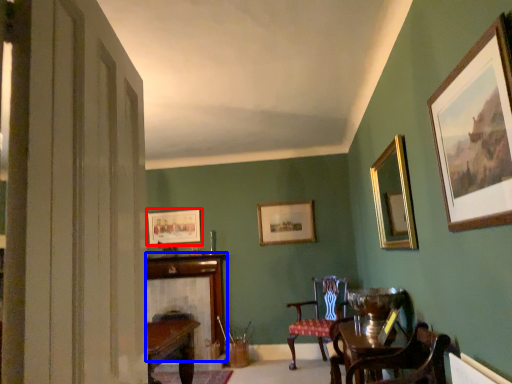
Question: Among these objects, which one is farthest to the camera, picture frame (highlighted by a red box) or fireplace (highlighted by a blue box)?

Choices:
 (A) picture frame
 (B) fireplace

Answer: (A)